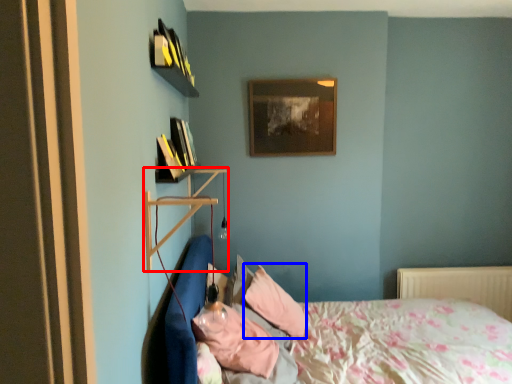
Question: Which object is closer to the camera taking this photo, shelf (highlighted by a red box) or pillow (highlighted by a blue box)?

Choices:
 (A) shelf
 (B) pillow

Answer: (A)